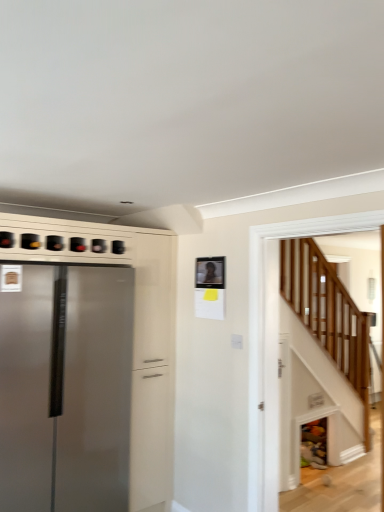
Question: Based on their positions, is satin silver refrigerator at left located to the left or right of wooden stairs at lower right?

Choices:
 (A) right
 (B) left

Answer: (B)

Question: In the image, is satin silver refrigerator at left positioned in front of or behind wooden stairs at lower right?

Choices:
 (A) behind
 (B) front

Answer: (A)

Question: Considering the positions of point (107, 481) and point (365, 358), is point (107, 481) closer or farther from the camera than point (365, 358)?

Choices:
 (A) farther
 (B) closer

Answer: (B)

Question: From their relative heights in the image, would you say wooden stairs at lower right is taller or shorter than satin silver refrigerator at left?

Choices:
 (A) short
 (B) tall

Answer: (A)

Question: Looking at the image, does wooden stairs at lower right seem bigger or smaller compared to satin silver refrigerator at left?

Choices:
 (A) small
 (B) big

Answer: (A)

Question: Visually, is wooden stairs at lower right positioned to the left or to the right of satin silver refrigerator at left?

Choices:
 (A) left
 (B) right

Answer: (B)

Question: Is wooden stairs at lower right spatially inside satin silver refrigerator at left, or outside of it?

Choices:
 (A) inside
 (B) outside

Answer: (B)